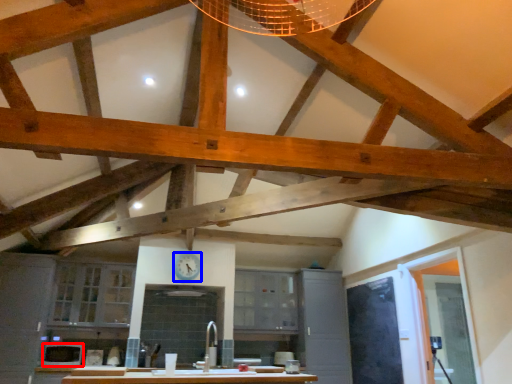
Question: Which object appears closest to the camera in this image, appliance (highlighted by a red box) or clock (highlighted by a blue box)?

Choices:
 (A) appliance
 (B) clock

Answer: (A)